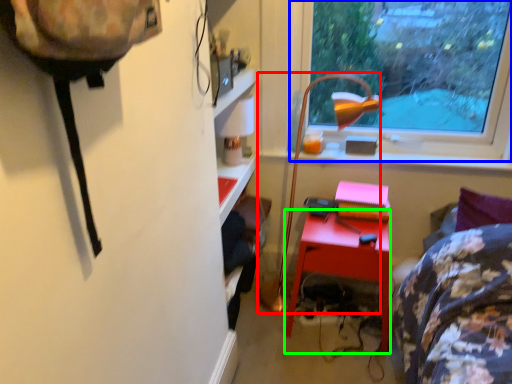
Question: Which object is positioned closest to lamp (highlighted by a red box)? Select from window (highlighted by a blue box) and desk (highlighted by a green box).

Choices:
 (A) window
 (B) desk

Answer: (B)